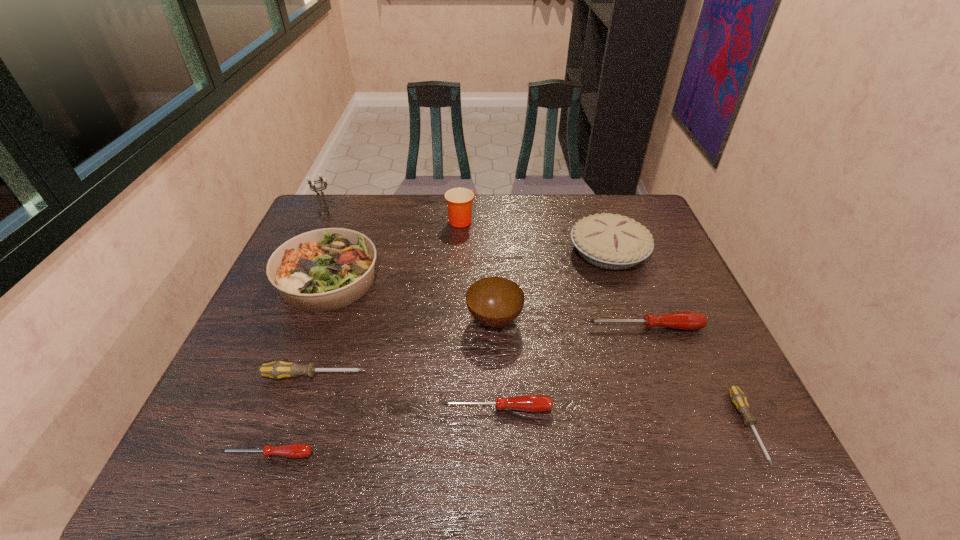
Find the location of a particular element. The image size is (960, 540). object that is the fifth nearest to the bowl is located at coordinates (322, 270).

Identify which object is the eighth nearest to the seventh farthest object. Please provide its 2D coordinates. Your answer should be formatted as a tuple, i.e. [(x, y)], where the tuple contains the x and y coordinates of a point satisfying the conditions above.

[(614, 242)]

Find the location of a particular element. screwdriver object that ranks as the second closest to the left gray screwdriver is located at coordinates (530, 403).

Locate an element on the screen. This screenshot has height=540, width=960. screwdriver that is the closest to the farther gray screwdriver is located at coordinates (297, 450).

Select which red screwdriver is the closest to the shortest object. Please provide its 2D coordinates. Your answer should be formatted as a tuple, i.e. [(x, y)], where the tuple contains the x and y coordinates of a point satisfying the conditions above.

[(530, 403)]

What are the coordinates of `red screwdriver identified as the closest to the second nearest red screwdriver` in the screenshot? It's located at (683, 320).

The image size is (960, 540). I want to click on free spot that satisfies the following two spatial constraints: 1. on the front side of the second tallest object; 2. on the right side of the farthest screwdriver, so click(x=454, y=327).